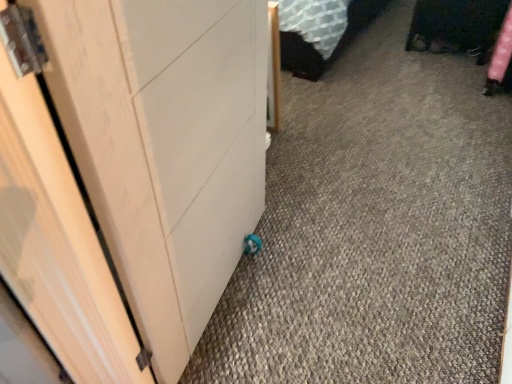
In order to face white matte door at lower left, should I rotate leftwards or rightwards?

To face it directly, rotate left by 3.700 degrees.

The width and height of the screenshot is (512, 384). Describe the element at coordinates (165, 146) in the screenshot. I see `white matte door at lower left` at that location.

At what (x,y) coordinates should I click in order to perform the action: click on white matte door at lower left. Please return your answer as a coordinate pair (x, y). Looking at the image, I should click on (165, 146).

This screenshot has width=512, height=384. In order to click on white matte door at lower left in this screenshot , I will do `click(165, 146)`.